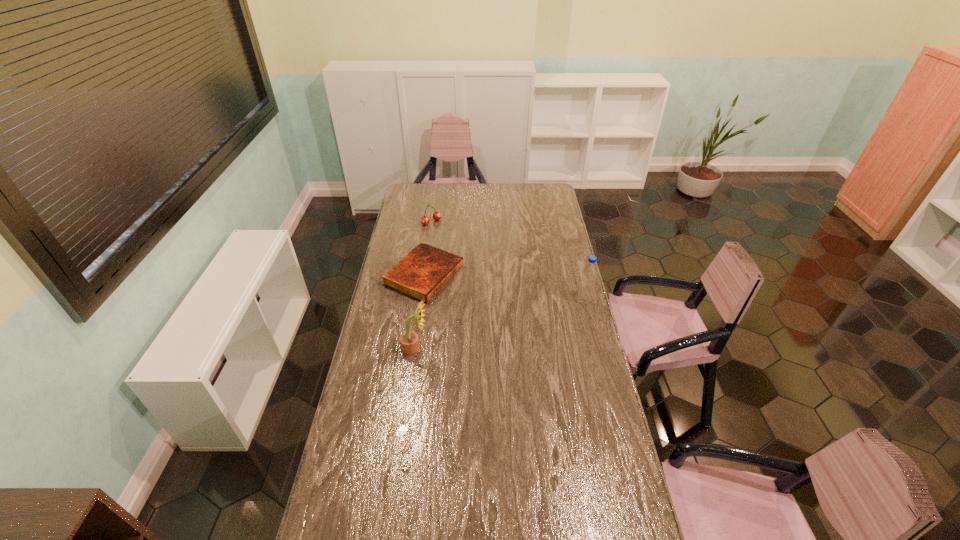
At what (x,y) coordinates should I click in order to perform the action: click on free location located 0.110m with stems pointing upwards on the cherry. Please return your answer as a coordinate pair (x, y). Looking at the image, I should click on point(446,236).

I want to click on free space located with stems pointing upwards on the cherry, so click(x=449, y=239).

At what (x,y) coordinates should I click in order to perform the action: click on vacant space located with stems pointing upwards on the cherry. Please return your answer as a coordinate pair (x, y). Image resolution: width=960 pixels, height=540 pixels. Looking at the image, I should click on (445, 235).

At what (x,y) coordinates should I click in order to perform the action: click on sunflower located at the left edge. Please return your answer as a coordinate pair (x, y). The image size is (960, 540). Looking at the image, I should click on (409, 342).

Where is `Bible located in the left edge section of the desktop`? The image size is (960, 540). Bible located in the left edge section of the desktop is located at coordinates (421, 274).

The image size is (960, 540). Identify the location of cherry that is at the left edge. (425, 220).

This screenshot has height=540, width=960. In order to click on object present at the right edge in this screenshot , I will do `click(589, 272)`.

The height and width of the screenshot is (540, 960). Find the location of `vacant space at the far edge`. vacant space at the far edge is located at coordinates click(505, 186).

In the image, there is a desktop. Identify the location of blank space at the near edge. (421, 519).

Where is `vacant point at the left edge`? Image resolution: width=960 pixels, height=540 pixels. vacant point at the left edge is located at coordinates (396, 295).